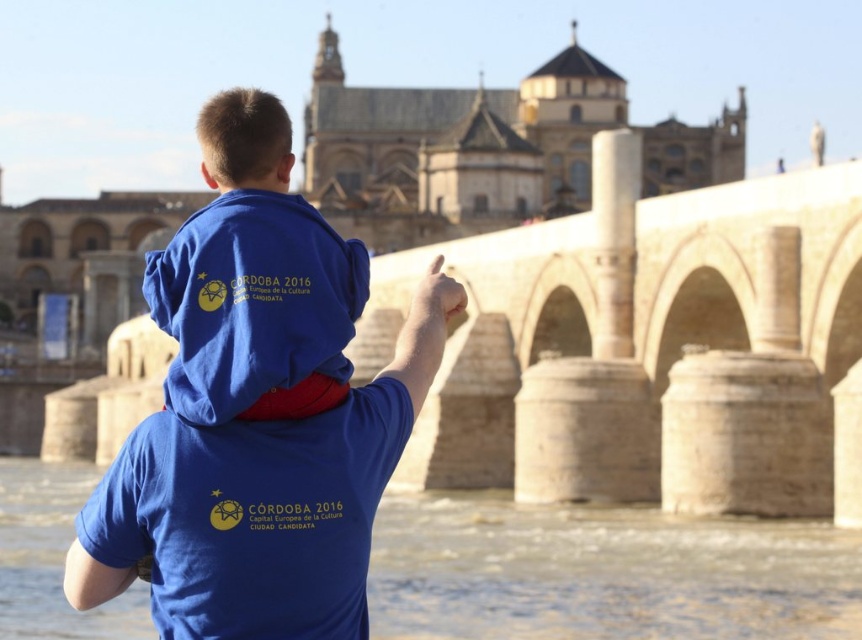
Question: Considering the relative positions of beige stone bridge at center and blue cotton shirt at center in the image provided, where is beige stone bridge at center located with respect to blue cotton shirt at center?

Choices:
 (A) above
 (B) below

Answer: (A)

Question: Which point is closer to the camera taking this photo?

Choices:
 (A) (66, 529)
 (B) (517, 394)
 (C) (286, 147)

Answer: (C)

Question: Which object is the closest to the blue cotton shirt at center?

Choices:
 (A) brown stone river at lower center
 (B) beige stone bridge at center

Answer: (A)

Question: Can you confirm if beige stone bridge at center is positioned to the left of brown stone river at lower center?

Choices:
 (A) no
 (B) yes

Answer: (A)

Question: Which of the following is the closest to the observer?

Choices:
 (A) (248, 358)
 (B) (581, 579)
 (C) (597, 339)

Answer: (A)

Question: Is beige stone bridge at center to the right of brown stone river at lower center from the viewer's perspective?

Choices:
 (A) yes
 (B) no

Answer: (A)